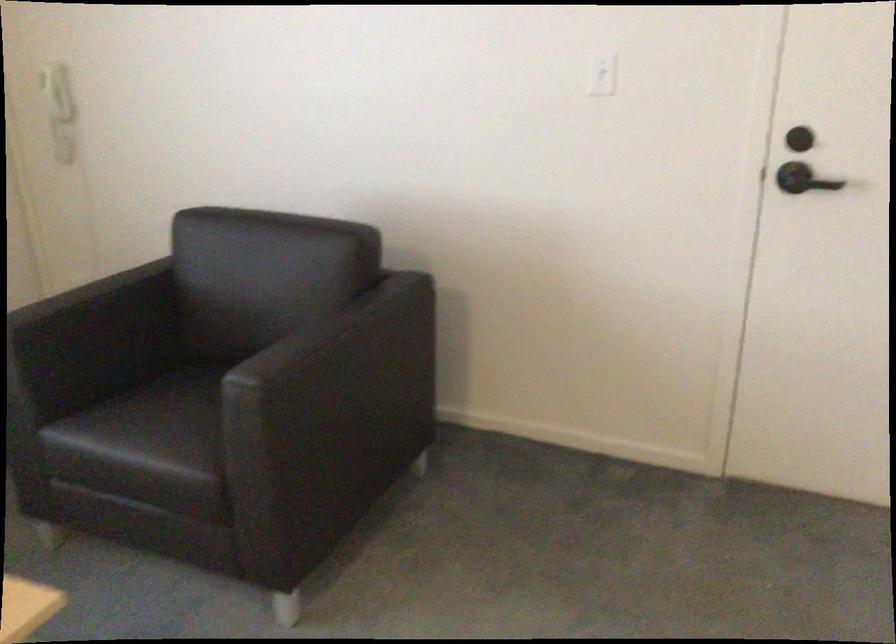
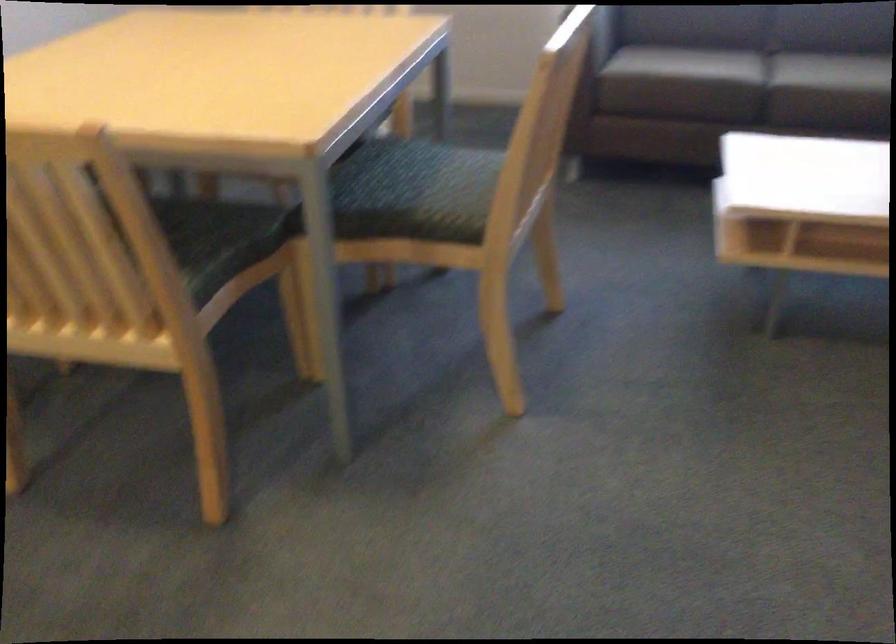
The first image is from the beginning of the video and the second image is from the end. How did the camera likely rotate when shooting the video?

The rotation direction of the camera is left-down.